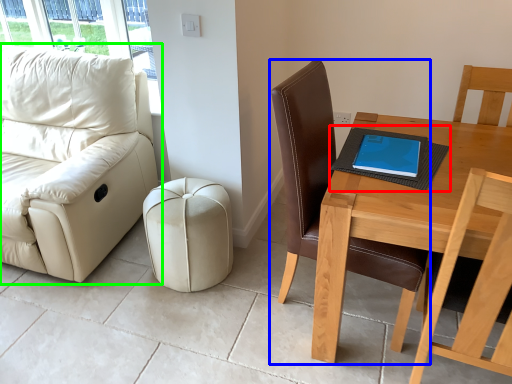
Question: Which is nearer to the notebook (highlighted by a red box)? chair (highlighted by a blue box) or studio couch (highlighted by a green box).

Choices:
 (A) chair
 (B) studio couch

Answer: (A)